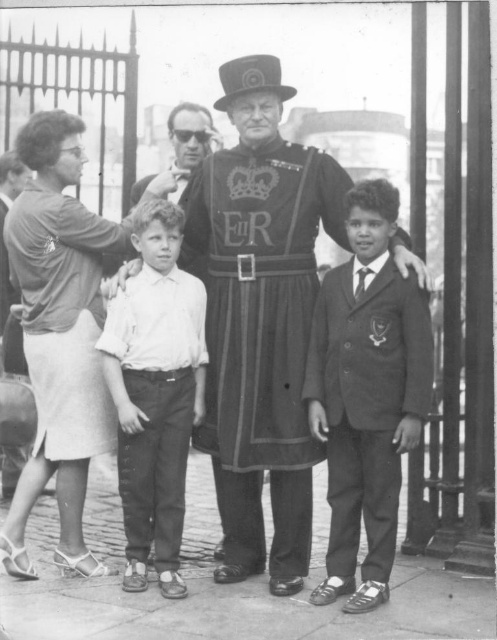
Question: Which of the following is the closest to the observer?

Choices:
 (A) (187, 384)
 (B) (380, 355)

Answer: (B)

Question: Can you confirm if smooth black suit at center is smaller than white cotton shirt at center?

Choices:
 (A) yes
 (B) no

Answer: (B)

Question: Does smooth black suit at center lie behind white cotton shirt at center?

Choices:
 (A) yes
 (B) no

Answer: (B)

Question: Which object appears farthest from the camera in this image?

Choices:
 (A) smooth black suit at center
 (B) white cotton shirt at center

Answer: (B)

Question: Which point appears farthest from the camera in this image?

Choices:
 (A) (154, 342)
 (B) (331, 552)

Answer: (A)

Question: Is smooth black suit at center below white cotton shirt at center?

Choices:
 (A) yes
 (B) no

Answer: (B)